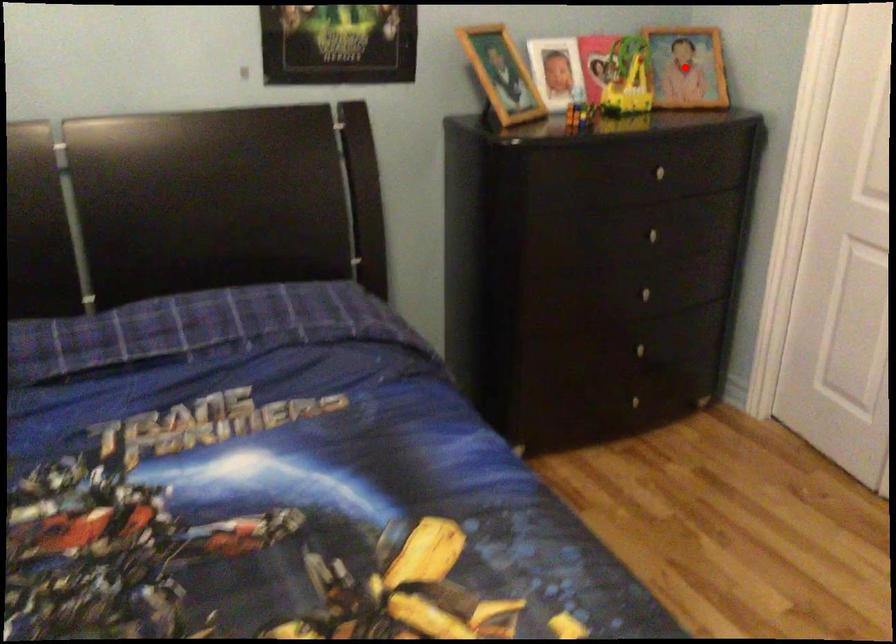
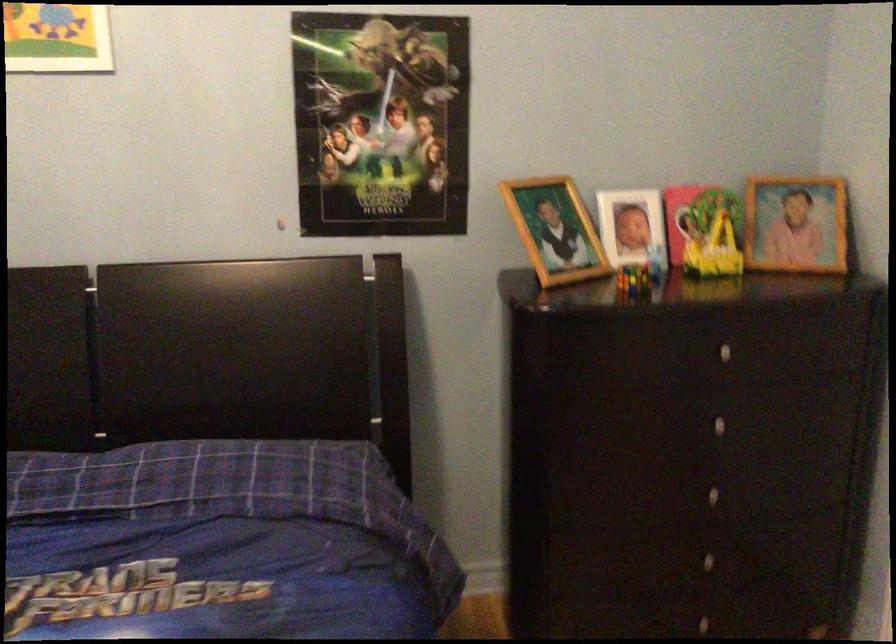
Where in the second image is the point corresponding to the highlighted location from the first image?

(796, 223)